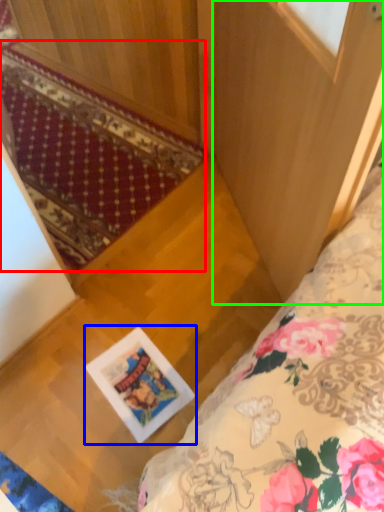
Question: Which is nearer to the mat (highlighted by a red box)? picture frame (highlighted by a blue box) or screen door (highlighted by a green box).

Choices:
 (A) picture frame
 (B) screen door

Answer: (B)